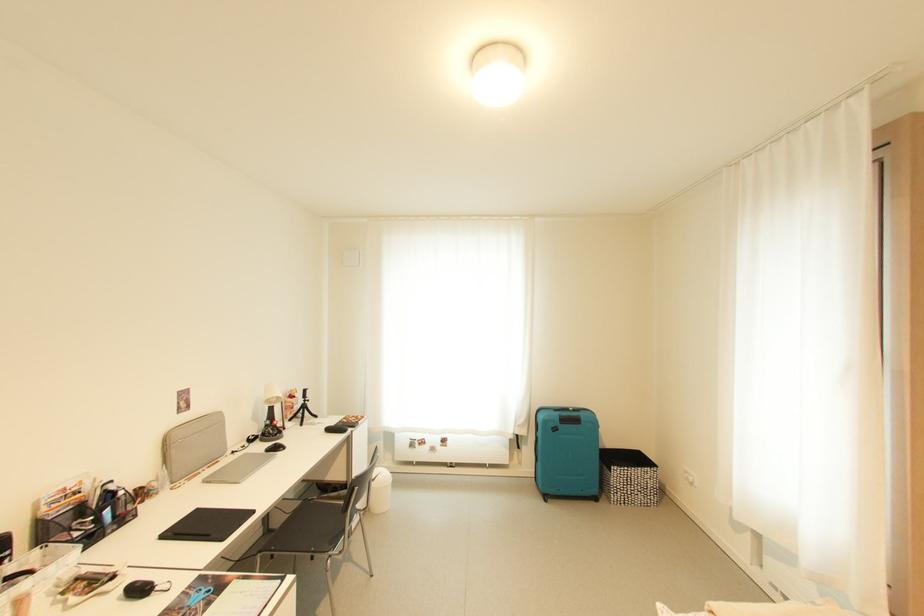
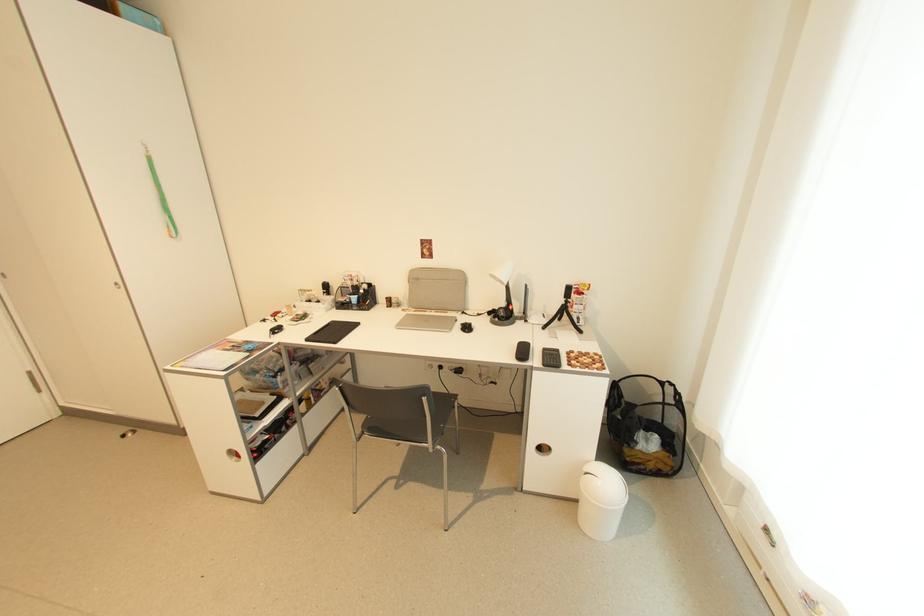
The point at [383,516] is marked in the first image. Where is the corresponding point in the second image?

(581, 524)